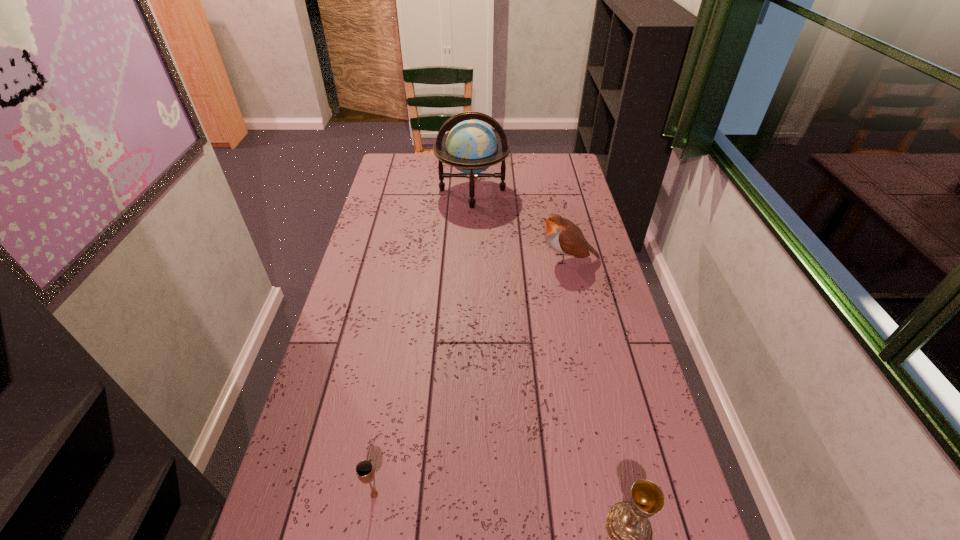
The height and width of the screenshot is (540, 960). In order to click on object situated at the far edge in this screenshot , I will do `click(471, 146)`.

Image resolution: width=960 pixels, height=540 pixels. In order to click on object that is at the right edge in this screenshot , I will do `click(565, 237)`.

Image resolution: width=960 pixels, height=540 pixels. In the image, there is a desktop. In order to click on blank space at the far edge in this screenshot , I will do `click(512, 179)`.

Find the location of `free location at the left edge of the desktop`. free location at the left edge of the desktop is located at coordinates coord(403,192).

You are a GUI agent. You are given a task and a screenshot of the screen. Output one action in this format:
    pyautogui.click(x=<x>, y=<y>)
    Task: Click on the free spot at the right edge of the desktop
    The width and height of the screenshot is (960, 540).
    Given the screenshot: What is the action you would take?
    pyautogui.click(x=608, y=326)

Find the location of a particular element. blank space at the far left corner is located at coordinates (399, 159).

Locate an element on the screen. Image resolution: width=960 pixels, height=540 pixels. free space between the second object from left to right and the left chalice is located at coordinates (423, 342).

In order to click on free point between the shortest object and the globe in this screenshot , I will do `click(423, 342)`.

Find the location of a particular element. The image size is (960, 540). vacant area that lies between the globe and the second farthest object is located at coordinates (520, 225).

The width and height of the screenshot is (960, 540). Find the location of `vacant area that lies between the third nearest object and the globe`. vacant area that lies between the third nearest object and the globe is located at coordinates (520, 225).